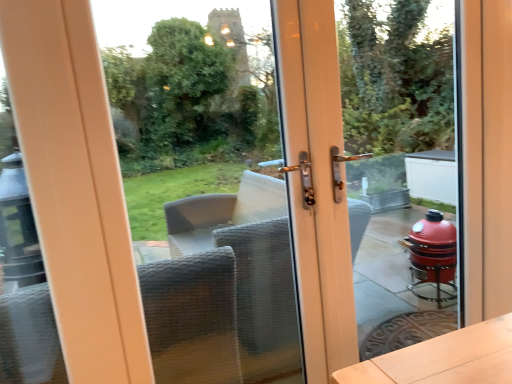
Question: Based on their positions, is transparent glass door at center located to the left or right of transparent glass door at center?

Choices:
 (A) right
 (B) left

Answer: (B)

Question: From the image's perspective, is transparent glass door at center above or below transparent glass door at center?

Choices:
 (A) below
 (B) above

Answer: (A)

Question: In terms of width, does transparent glass door at center look wider or thinner when compared to transparent glass door at center?

Choices:
 (A) thin
 (B) wide

Answer: (B)

Question: Relative to transparent glass door at center, is transparent glass door at center in front or behind?

Choices:
 (A) front
 (B) behind

Answer: (B)

Question: Is transparent glass door at center inside the boundaries of transparent glass door at center, or outside?

Choices:
 (A) inside
 (B) outside

Answer: (B)

Question: In terms of size, does transparent glass door at center appear bigger or smaller than transparent glass door at center?

Choices:
 (A) small
 (B) big

Answer: (A)

Question: Considering the positions of transparent glass door at center and transparent glass door at center in the image, is transparent glass door at center wider or thinner than transparent glass door at center?

Choices:
 (A) thin
 (B) wide

Answer: (A)